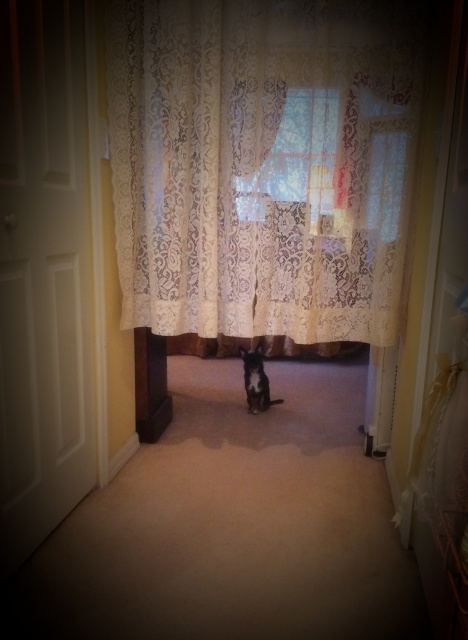
Question: Estimate the real-world distances between objects in this image. Which object is farther from the white lace curtain at center?

Choices:
 (A) brown wood pillar at left
 (B) translucent lace curtain at center

Answer: (A)

Question: Is white lace curtain at center behind translucent lace curtain at center?

Choices:
 (A) yes
 (B) no

Answer: (B)

Question: Based on their relative distances, which object is farther from the brown wood pillar at left?

Choices:
 (A) white lace curtain at center
 (B) translucent lace curtain at center

Answer: (B)

Question: Does translucent lace curtain at center have a smaller size compared to brown wood pillar at left?

Choices:
 (A) no
 (B) yes

Answer: (B)

Question: Among these objects, which one is farthest from the camera?

Choices:
 (A) white lace curtain at center
 (B) translucent lace curtain at center
 (C) brown wood pillar at left

Answer: (C)

Question: Where is white lace curtain at center located in relation to brown wood pillar at left in the image?

Choices:
 (A) above
 (B) below

Answer: (A)